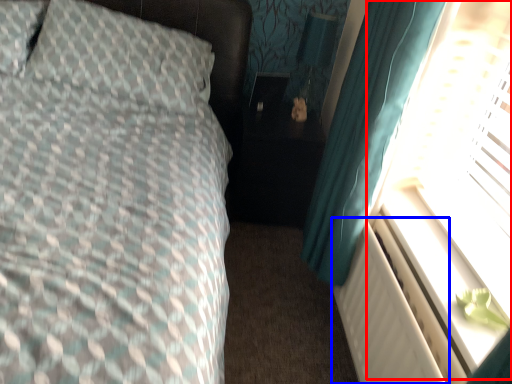
Question: Which object is further to the camera taking this photo, window screen (highlighted by a red box) or radiator (highlighted by a blue box)?

Choices:
 (A) window screen
 (B) radiator

Answer: (B)